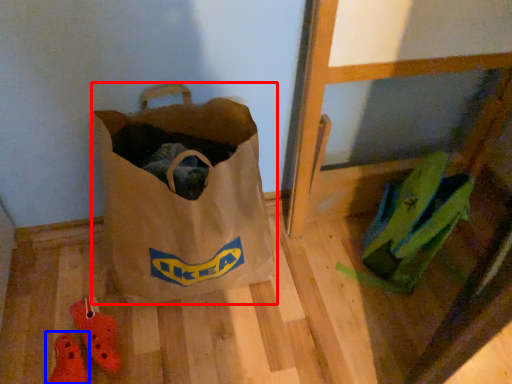
Question: Which object is further to the camera taking this photo, luggage and bags (highlighted by a red box) or footwear (highlighted by a blue box)?

Choices:
 (A) luggage and bags
 (B) footwear

Answer: (B)